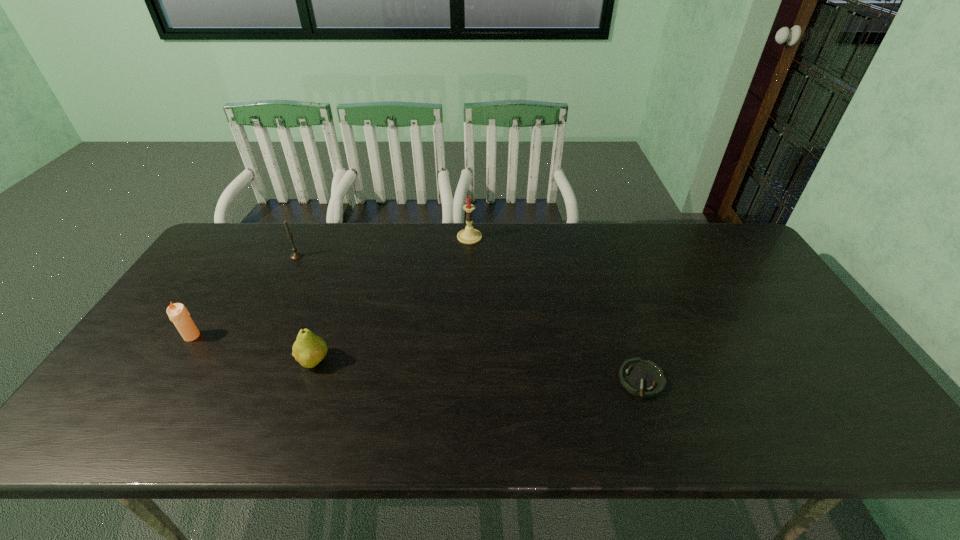
Where is `blank area at the far right corner`? This screenshot has width=960, height=540. blank area at the far right corner is located at coordinates (714, 247).

You are a GUI agent. You are given a task and a screenshot of the screen. Output one action in this format:
    pyautogui.click(x=<x>, y=<y>)
    Task: Click on the vacant space in between the rightmost object and the pear
    The width and height of the screenshot is (960, 540).
    Given the screenshot: What is the action you would take?
    pyautogui.click(x=477, y=370)

The image size is (960, 540). Find the location of `vacant space in between the shortest object and the third object from left to right`. vacant space in between the shortest object and the third object from left to right is located at coordinates (477, 370).

You are a GUI agent. You are given a task and a screenshot of the screen. Output one action in this format:
    pyautogui.click(x=<x>, y=<y>)
    Task: Click on the free area in between the second object from right to left and the third nearest object
    The width and height of the screenshot is (960, 540).
    Given the screenshot: What is the action you would take?
    pyautogui.click(x=331, y=287)

Where is `vacant space in between the third object from left to right and the second object from left to right`? vacant space in between the third object from left to right and the second object from left to right is located at coordinates (305, 308).

Where is `vacant area between the nearest candle and the pear`? This screenshot has width=960, height=540. vacant area between the nearest candle and the pear is located at coordinates (252, 348).

Locate an element on the screen. The width and height of the screenshot is (960, 540). empty location between the pear and the farthest candle is located at coordinates (392, 299).

Locate an element on the screen. This screenshot has height=540, width=960. unoccupied area between the second object from left to right and the pear is located at coordinates (305, 308).

Locate an element on the screen. This screenshot has width=960, height=540. free area in between the third object from left to right and the third nearest object is located at coordinates (252, 348).

I want to click on free spot between the second candle from left to right and the farthest object, so click(383, 246).